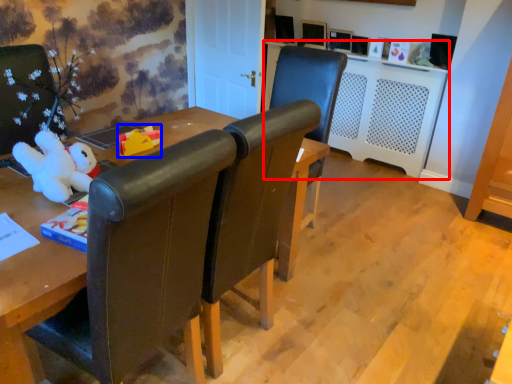
Question: Which object is closer to the camera taking this photo, computer desk (highlighted by a red box) or toy (highlighted by a blue box)?

Choices:
 (A) computer desk
 (B) toy

Answer: (B)